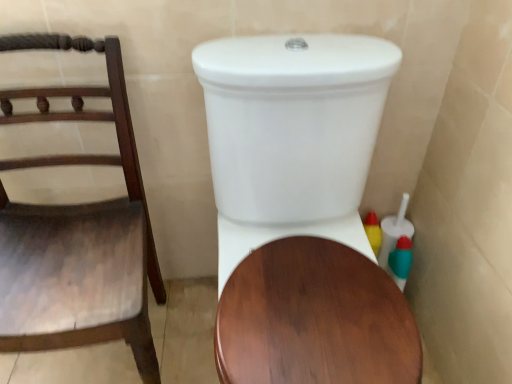
This screenshot has height=384, width=512. What do you see at coordinates (301, 211) in the screenshot?
I see `white glossy toilet at center` at bounding box center [301, 211].

Locate an element on the screen. The image size is (512, 384). white glossy toilet at center is located at coordinates (301, 211).

Image resolution: width=512 pixels, height=384 pixels. Describe the element at coordinates (78, 234) in the screenshot. I see `wooden chair at left` at that location.

Find the location of `wooden chair at left`. wooden chair at left is located at coordinates (78, 234).

Image resolution: width=512 pixels, height=384 pixels. I want to click on white glossy toilet at center, so click(x=301, y=211).

Would you say wooden chair at left is to the left or to the right of white glossy toilet at center in the picture?

Based on their positions, wooden chair at left is located to the left of white glossy toilet at center.

Looking at this image, which is in front, wooden chair at left or white glossy toilet at center?

Positioned in front is white glossy toilet at center.

Is point (145, 239) more distant than point (307, 113)?

Yes, it is behind point (307, 113).

From the image's perspective, is wooden chair at left positioned above or below white glossy toilet at center?

wooden chair at left is above white glossy toilet at center.

Based on the photo, from a real-world perspective, is wooden chair at left above or below white glossy toilet at center?

Clearly, from a real-world perspective, wooden chair at left is below white glossy toilet at center.

Considering the sizes of objects wooden chair at left and white glossy toilet at center in the image provided, who is thinner, wooden chair at left or white glossy toilet at center?

With smaller width is wooden chair at left.

Can you confirm if wooden chair at left is taller than white glossy toilet at center?

No, wooden chair at left is not taller than white glossy toilet at center.

Which of these two, wooden chair at left or white glossy toilet at center, is smaller?

wooden chair at left.

Is wooden chair at left inside the boundaries of white glossy toilet at center, or outside?

wooden chair at left is not inside white glossy toilet at center, it's outside.

Would you consider wooden chair at left to be distant from white glossy toilet at center?

No, wooden chair at left is not far away from white glossy toilet at center.

Is wooden chair at left positioned with its back to white glossy toilet at center?

No, wooden chair at left's orientation is not away from white glossy toilet at center.

Locate an element on the screen. toilet in front of the wooden chair at left is located at coordinates (301, 211).

Considering the relative positions of white glossy toilet at center and wooden chair at left in the image provided, is white glossy toilet at center to the left of wooden chair at left from the viewer's perspective?

Incorrect, white glossy toilet at center is not on the left side of wooden chair at left.

Relative to wooden chair at left, is white glossy toilet at center in front or behind?

Visually, white glossy toilet at center is located in front of wooden chair at left.

Is point (359, 86) closer or farther from the camera than point (131, 163)?

Clearly, point (359, 86) is closer to the camera than point (131, 163).

From the image's perspective, is white glossy toilet at center beneath wooden chair at left?

Yes, from the image's perspective, white glossy toilet at center is beneath wooden chair at left.

From a real-world perspective, is white glossy toilet at center above or below wooden chair at left?

From a real-world perspective, white glossy toilet at center is physically above wooden chair at left.

Can you confirm if white glossy toilet at center is thinner than wooden chair at left?

In fact, white glossy toilet at center might be wider than wooden chair at left.

From their relative heights in the image, would you say white glossy toilet at center is taller or shorter than wooden chair at left?

white glossy toilet at center is taller than wooden chair at left.

In terms of size, does white glossy toilet at center appear bigger or smaller than wooden chair at left?

In the image, white glossy toilet at center appears to be larger than wooden chair at left.

Would you say wooden chair at left is part of white glossy toilet at center's contents?

No, wooden chair at left is located outside of white glossy toilet at center.

Is the surface of white glossy toilet at center in direct contact with wooden chair at left?

No, white glossy toilet at center is not beside wooden chair at left.

Is white glossy toilet at center turned away from wooden chair at left?

No, white glossy toilet at center is not facing the opposite direction of wooden chair at left.

How far apart are white glossy toilet at center and wooden chair at left?

white glossy toilet at center and wooden chair at left are 13.64 inches apart from each other.

Find the location of a particular element. This screenshot has width=512, height=384. chair on the left of white glossy toilet at center is located at coordinates (78, 234).

Locate an element on the screen. The image size is (512, 384). toilet to the right of wooden chair at left is located at coordinates (301, 211).

At what (x,y) coordinates should I click in order to perform the action: click on toilet above the wooden chair at left (from a real-world perspective). Please return your answer as a coordinate pair (x, y). The width and height of the screenshot is (512, 384). Looking at the image, I should click on (301, 211).